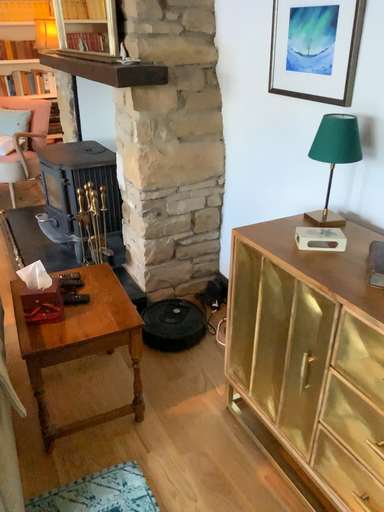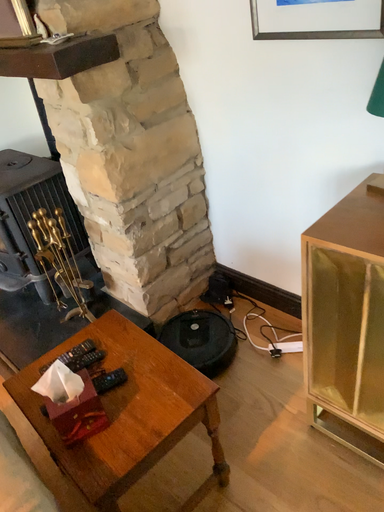
Question: How did the camera likely rotate when shooting the video?

Choices:
 (A) rotated left
 (B) rotated right

Answer: (B)